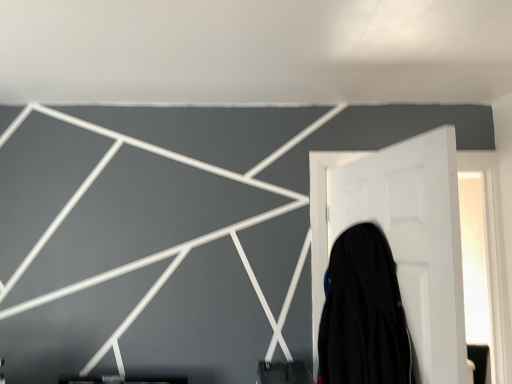
Question: Considering the positions of white matte door at right and black fabric at right in the image, is white matte door at right taller or shorter than black fabric at right?

Choices:
 (A) tall
 (B) short

Answer: (A)

Question: Is point (418, 332) closer or farther from the camera than point (349, 327)?

Choices:
 (A) closer
 (B) farther

Answer: (A)

Question: Visually, is white matte door at right positioned to the left or to the right of black fabric at right?

Choices:
 (A) right
 (B) left

Answer: (A)

Question: Considering the positions of point (349, 365) and point (326, 201), is point (349, 365) closer or farther from the camera than point (326, 201)?

Choices:
 (A) closer
 (B) farther

Answer: (A)

Question: Is black fabric at right bigger or smaller than white matte door at right?

Choices:
 (A) big
 (B) small

Answer: (B)

Question: From the image's perspective, is black fabric at right located above or below white matte door at right?

Choices:
 (A) above
 (B) below

Answer: (B)

Question: Is black fabric at right taller or shorter than white matte door at right?

Choices:
 (A) tall
 (B) short

Answer: (B)